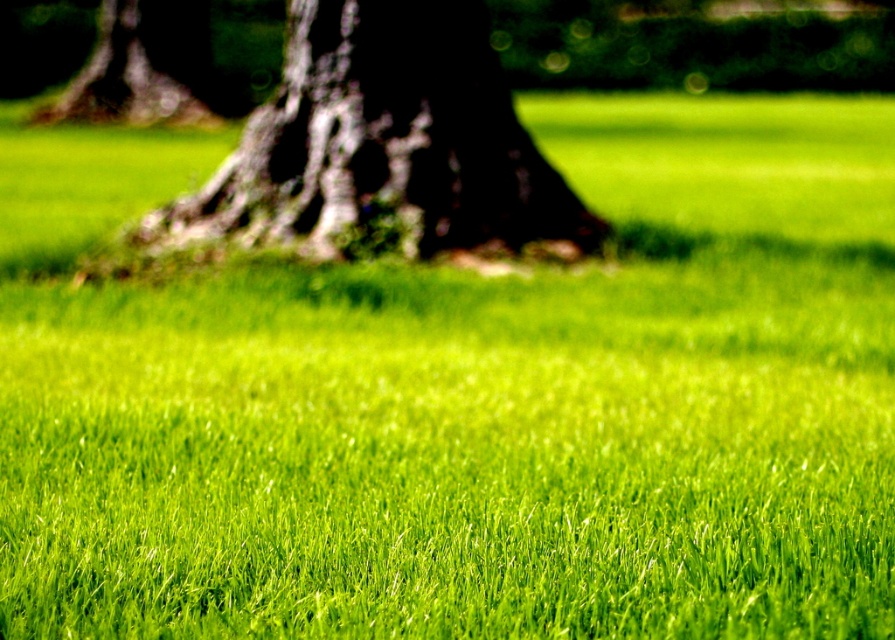
Question: Considering the relative positions of dark brown textured trunk at center and dark brown bark at upper left in the image provided, where is dark brown textured trunk at center located with respect to dark brown bark at upper left?

Choices:
 (A) below
 (B) above

Answer: (A)

Question: Is dark brown textured trunk at center closer to camera compared to dark brown bark at upper left?

Choices:
 (A) yes
 (B) no

Answer: (A)

Question: Is dark brown textured trunk at center smaller than dark brown bark at upper left?

Choices:
 (A) no
 (B) yes

Answer: (B)

Question: Which point is farther to the camera?

Choices:
 (A) dark brown bark at upper left
 (B) dark brown textured trunk at center

Answer: (A)

Question: Which point is farther to the camera?

Choices:
 (A) (455, 35)
 (B) (142, 56)

Answer: (B)

Question: Among these objects, which one is nearest to the camera?

Choices:
 (A) dark brown textured trunk at center
 (B) dark brown bark at upper left

Answer: (A)